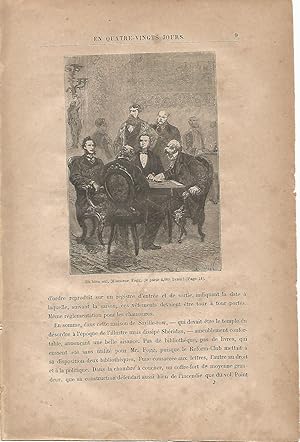
Identify the location of right front leg of the table. The image size is (300, 442). (169, 227).